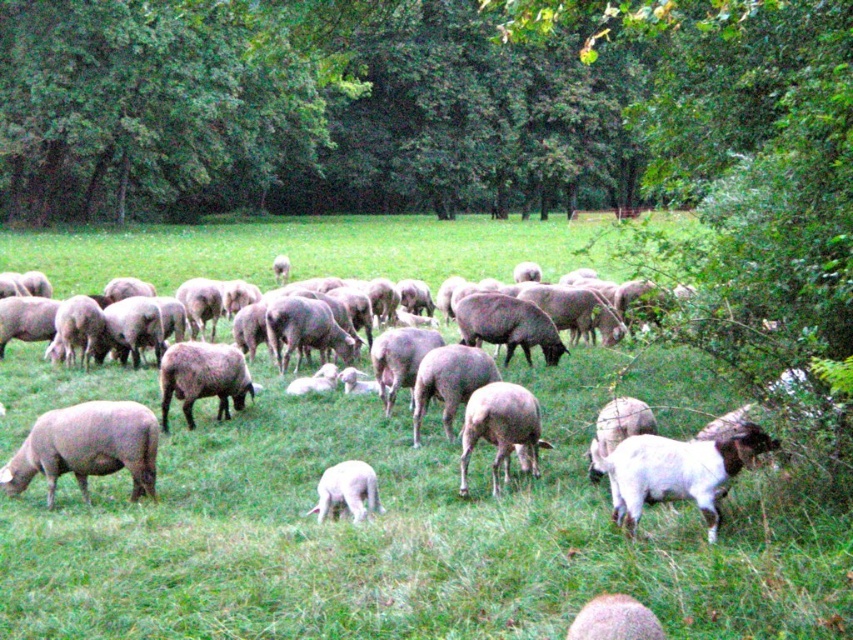
This screenshot has width=853, height=640. What do you see at coordinates (148, 106) in the screenshot?
I see `green leafy tree at upper left` at bounding box center [148, 106].

Between point (137, 65) and point (599, 609), which one is positioned in front?

Point (599, 609) is more forward.

What are the coordinates of `green leafy tree at upper left` in the screenshot? It's located at (148, 106).

Measure the distance between green leafy tree at upper center and camera.

green leafy tree at upper center and camera are 14.88 feet apart from each other.

What are the coordinates of `green leafy tree at upper center` in the screenshot? It's located at (409, 102).

Does white woolen sheep at lower right have a lesser height compared to fuzzy woolly sheep at lower center?

No.

Which is in front, point (654, 451) or point (625, 625)?

Point (625, 625) is more forward.

Which is in front, point (723, 452) or point (639, 611)?

Positioned in front is point (639, 611).

Where is `white woolen sheep at lower right`? Image resolution: width=853 pixels, height=640 pixels. white woolen sheep at lower right is located at coordinates (676, 470).